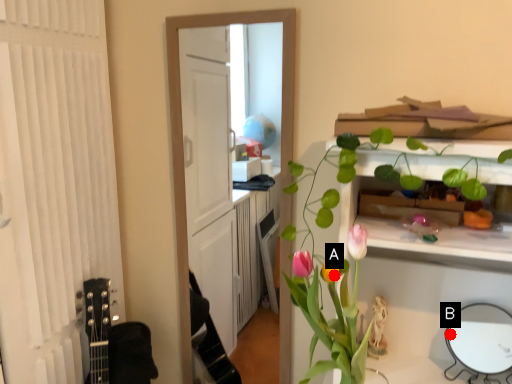
Question: Two points are circled on the image, labeled by A and B beside each circle. Among these points, which one is farthest from the camera?

Choices:
 (A) A is further
 (B) B is further

Answer: (B)